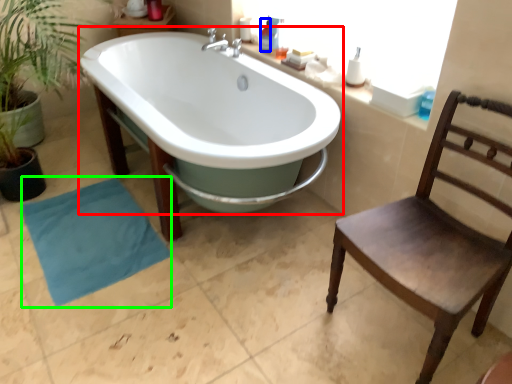
Question: Which object is the closest to the bathtub (highlighted by a red box)? Choose among these: toiletry (highlighted by a blue box) or beach towel (highlighted by a green box).

Choices:
 (A) toiletry
 (B) beach towel

Answer: (A)